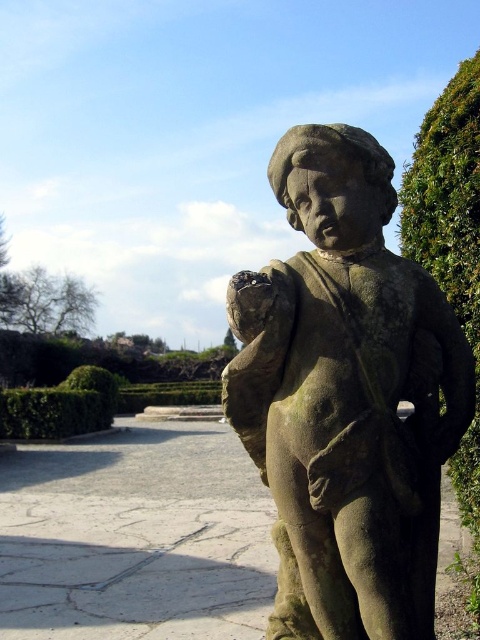
Does stone statue at center have a lesser height compared to green leafy bush at right?

Indeed, stone statue at center has a lesser height compared to green leafy bush at right.

Measure the distance from stone statue at center to green leafy bush at right.

20.22 inches

Where is `stone statue at center`? stone statue at center is located at coordinates coord(347,397).

At what (x,y) coordinates should I click in order to perform the action: click on stone statue at center. Please return your answer as a coordinate pair (x, y). This screenshot has width=480, height=640. Looking at the image, I should click on (347, 397).